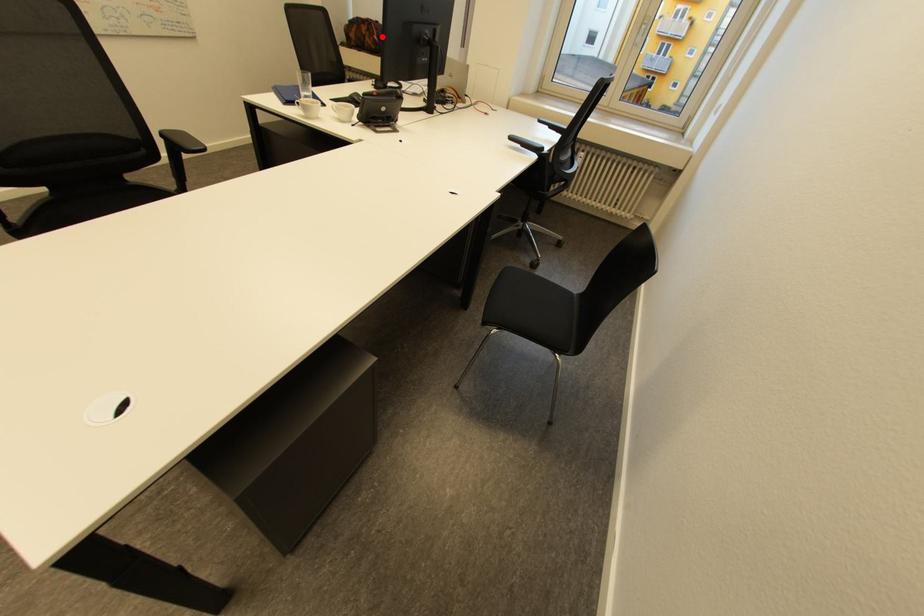
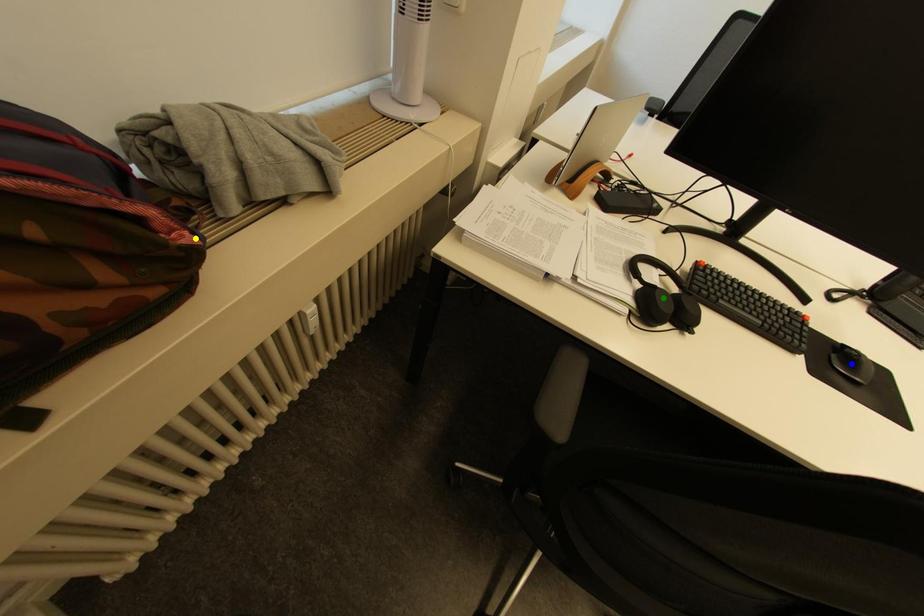
Question: I am providing you with two images of the same scene from different viewpoints. A red point is marked on the first image. You are given multiple points on the second image. Which spot in image 2 lines up with the point in image 1?

Choices:
 (A) green point
 (B) blue point
 (C) yellow point

Answer: (C)